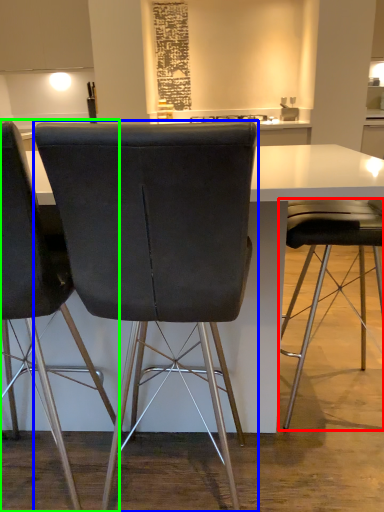
Question: Which object is the farthest from chair (highlighted by a red box)? Choose among these: chair (highlighted by a blue box) or chair (highlighted by a green box).

Choices:
 (A) chair
 (B) chair

Answer: (B)